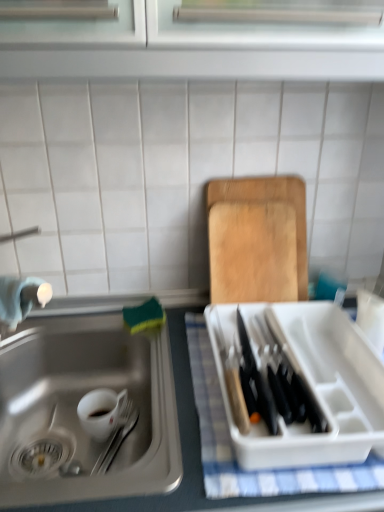
Question: From the image's perspective, is stainless steel sink at lower left above wooden cutting board at upper right?

Choices:
 (A) no
 (B) yes

Answer: (A)

Question: Does stainless steel sink at lower left have a lesser height compared to wooden cutting board at upper right?

Choices:
 (A) yes
 (B) no

Answer: (A)

Question: Is stainless steel sink at lower left surrounding wooden cutting board at upper right?

Choices:
 (A) no
 (B) yes

Answer: (A)

Question: From a real-world perspective, does stainless steel sink at lower left sit lower than wooden cutting board at upper right?

Choices:
 (A) yes
 (B) no

Answer: (A)

Question: Considering the relative sizes of stainless steel sink at lower left and wooden cutting board at upper right in the image provided, is stainless steel sink at lower left bigger than wooden cutting board at upper right?

Choices:
 (A) no
 (B) yes

Answer: (B)

Question: From the image's perspective, relative to wooden cutting board at upper right, is white checkered cloth at right above or below?

Choices:
 (A) below
 (B) above

Answer: (A)

Question: Based on their sizes in the image, would you say white checkered cloth at right is bigger or smaller than wooden cutting board at upper right?

Choices:
 (A) big
 (B) small

Answer: (B)

Question: From a real-world perspective, relative to wooden cutting board at upper right, is white checkered cloth at right vertically above or below?

Choices:
 (A) below
 (B) above

Answer: (A)

Question: Would you say white checkered cloth at right is to the left or to the right of wooden cutting board at upper right in the picture?

Choices:
 (A) left
 (B) right

Answer: (B)

Question: Looking at the image, does white checkered cloth at right seem bigger or smaller compared to stainless steel sink at lower left?

Choices:
 (A) small
 (B) big

Answer: (A)

Question: In the image, is white checkered cloth at right positioned in front of or behind stainless steel sink at lower left?

Choices:
 (A) front
 (B) behind

Answer: (B)

Question: Is white checkered cloth at right inside or outside of stainless steel sink at lower left?

Choices:
 (A) inside
 (B) outside

Answer: (B)

Question: Would you say white checkered cloth at right is to the left or to the right of stainless steel sink at lower left in the picture?

Choices:
 (A) left
 (B) right

Answer: (B)

Question: From the image's perspective, relative to stainless steel sink at lower left, is wooden cutting board at upper right above or below?

Choices:
 (A) above
 (B) below

Answer: (A)

Question: Is point (236, 265) closer or farther from the camera than point (158, 425)?

Choices:
 (A) farther
 (B) closer

Answer: (A)